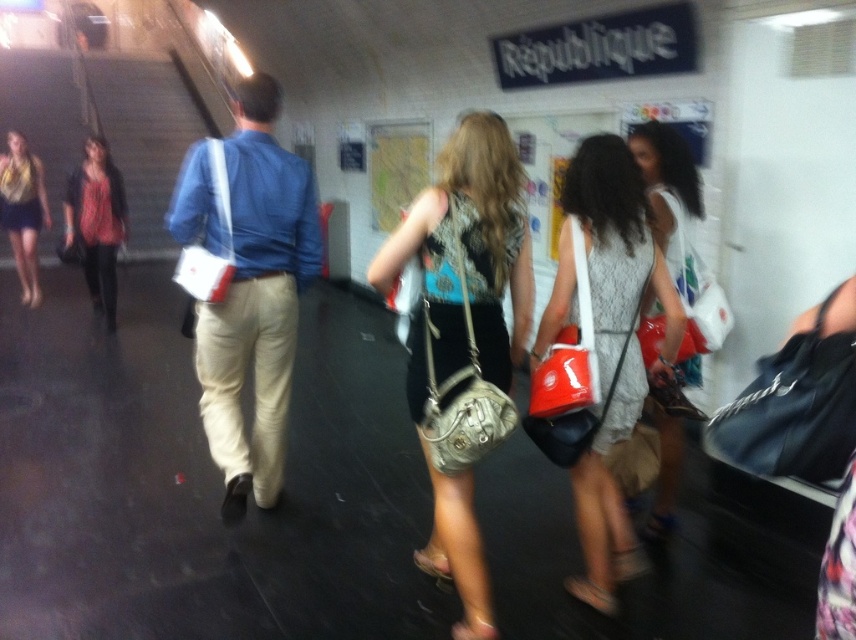
You are a commuter waiting at the subway station and notice a leather purse at center and a black fabric bag at lower right. Which item is closer to you?

The leather purse at center is closer to you because it is further to the viewer than the black fabric bag at lower right.

You are a photographer positioned at the entrance of the subway station. You want to capture a photo that includes both the white fabric dress at center and the matte yellow scarf at left. Based on their positions, which object should you ensure is closer to the camera to include both in the frame?

Since the white fabric dress at center is in front of the matte yellow scarf at left, you should ensure the white fabric dress at center is closer to the camera to include both in the frame.

You are a photographer trying to capture a candid shot of the white fabric dress at center and the matte yellow scarf at left in the subway station. Since you want to ensure both subjects are in focus, you need to know which one is wider. Can you tell me which is wider?

The white fabric dress at center is less wide than the matte yellow scarf at left, so the matte yellow scarf at left is wider.